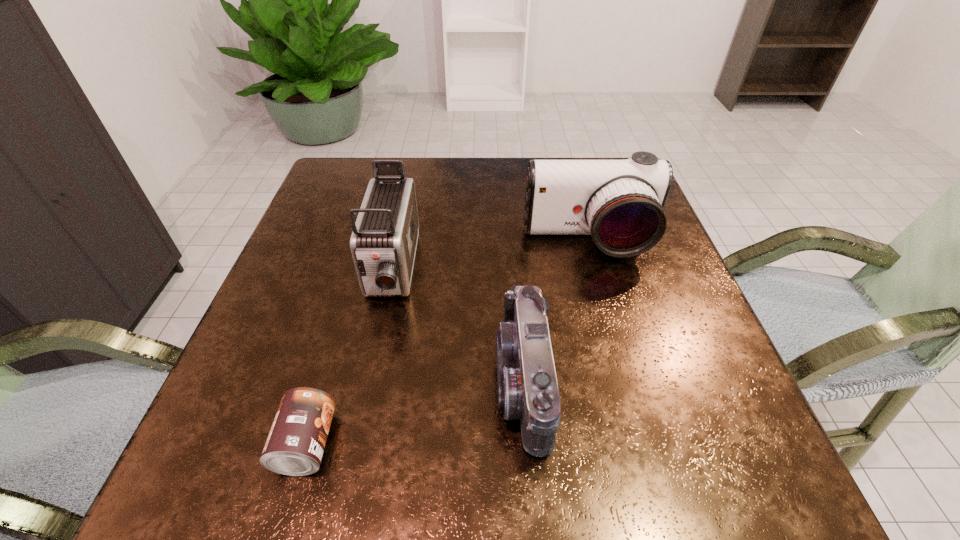
The image size is (960, 540). Find the location of `free spot between the third tallest object and the shortest object`. free spot between the third tallest object and the shortest object is located at coordinates (416, 413).

Find the location of a particular element. The height and width of the screenshot is (540, 960). free space between the nearest camcorder and the leftmost camcorder is located at coordinates (458, 326).

The image size is (960, 540). Find the location of `empty space that is in between the leftmost camcorder and the nearest camcorder`. empty space that is in between the leftmost camcorder and the nearest camcorder is located at coordinates (458, 326).

Identify which object is the third nearest to the nearest camcorder. Please provide its 2D coordinates. Your answer should be formatted as a tuple, i.e. [(x, y)], where the tuple contains the x and y coordinates of a point satisfying the conditions above.

[(295, 445)]

I want to click on object that can be found as the third closest to the nearest camcorder, so click(295, 445).

Where is `camcorder identified as the second closest to the leftmost camcorder`? The image size is (960, 540). camcorder identified as the second closest to the leftmost camcorder is located at coordinates (620, 203).

The width and height of the screenshot is (960, 540). Identify the location of camcorder that is the second closest to the shortest camcorder. (383, 243).

Find the location of a particular element. The image size is (960, 540). vacant space that satisfies the following two spatial constraints: 1. at the lens of the leftmost camcorder; 2. on the front label of the can is located at coordinates (355, 444).